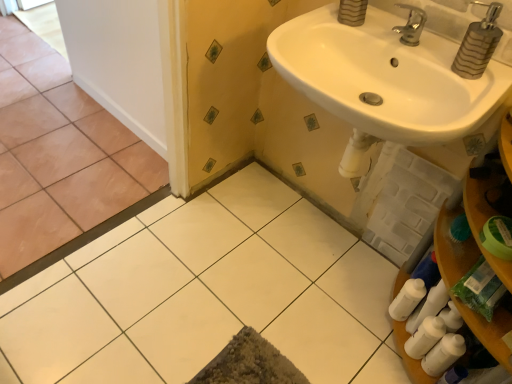
Question: Considering the relative sizes of silver metallic faucet at upper right and metallic striped soap dispenser at upper right in the image provided, is silver metallic faucet at upper right smaller than metallic striped soap dispenser at upper right?

Choices:
 (A) no
 (B) yes

Answer: (B)

Question: Considering the relative positions of silver metallic faucet at upper right and metallic striped soap dispenser at upper right in the image provided, is silver metallic faucet at upper right in front of metallic striped soap dispenser at upper right?

Choices:
 (A) no
 (B) yes

Answer: (A)

Question: From a real-world perspective, does silver metallic faucet at upper right stand above metallic striped soap dispenser at upper right?

Choices:
 (A) no
 (B) yes

Answer: (A)

Question: Is silver metallic faucet at upper right at the right side of metallic striped soap dispenser at upper right?

Choices:
 (A) no
 (B) yes

Answer: (A)

Question: Does silver metallic faucet at upper right have a lesser height compared to metallic striped soap dispenser at upper right?

Choices:
 (A) yes
 (B) no

Answer: (A)

Question: Would you say white glossy sink at upper right is inside or outside white glossy tile at center, the 1th ceramic tile when ordered from right to left?

Choices:
 (A) outside
 (B) inside

Answer: (A)

Question: From a real-world perspective, is white glossy sink at upper right above or below white glossy tile at center, the 1th ceramic tile when ordered from right to left?

Choices:
 (A) above
 (B) below

Answer: (A)

Question: Considering the relative positions of white glossy sink at upper right and white glossy tile at center, marked as the 2th ceramic tile in a left-to-right arrangement, in the image provided, is white glossy sink at upper right to the left or to the right of white glossy tile at center, marked as the 2th ceramic tile in a left-to-right arrangement,?

Choices:
 (A) left
 (B) right

Answer: (B)

Question: In the image, is white glossy sink at upper right positioned in front of or behind white glossy tile at center, marked as the 2th ceramic tile in a left-to-right arrangement?

Choices:
 (A) front
 (B) behind

Answer: (A)

Question: In terms of size, does metallic striped soap dispenser at upper right appear bigger or smaller than brown matte tile at left, arranged as the second ceramic tile when viewed from the right?

Choices:
 (A) big
 (B) small

Answer: (B)

Question: Looking at their shapes, would you say metallic striped soap dispenser at upper right is wider or thinner than brown matte tile at left, which appears as the 1th ceramic tile when viewed from the left?

Choices:
 (A) thin
 (B) wide

Answer: (A)

Question: Is point (472, 64) positioned closer to the camera than point (2, 61)?

Choices:
 (A) closer
 (B) farther

Answer: (A)

Question: From the image's perspective, is metallic striped soap dispenser at upper right located above or below brown matte tile at left, arranged as the second ceramic tile when viewed from the right?

Choices:
 (A) below
 (B) above

Answer: (A)

Question: Looking at their shapes, would you say white glossy tile at center, the 1th ceramic tile when ordered from right to left, is wider or thinner than white glossy sink at upper right?

Choices:
 (A) thin
 (B) wide

Answer: (B)

Question: Does point (352, 311) appear closer or farther from the camera than point (396, 137)?

Choices:
 (A) farther
 (B) closer

Answer: (A)